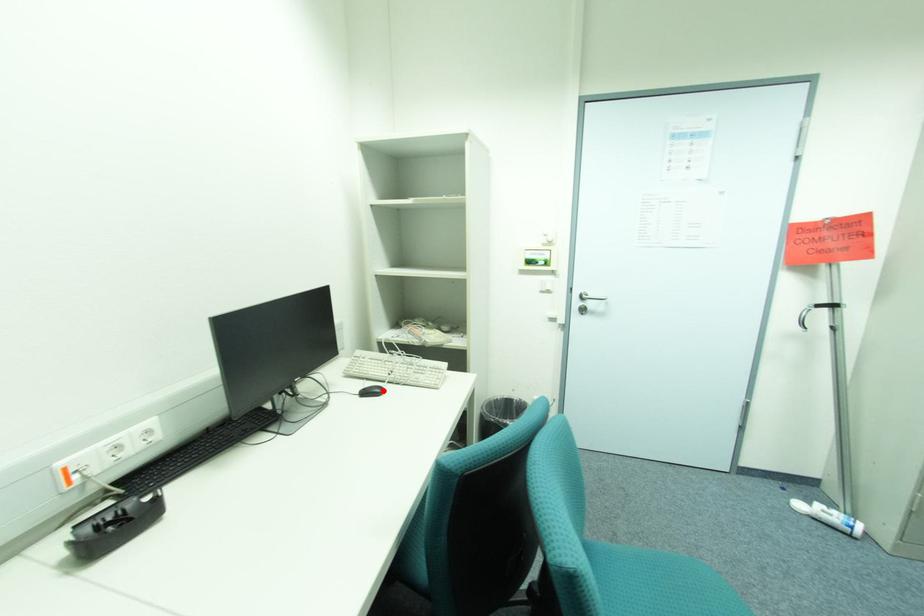
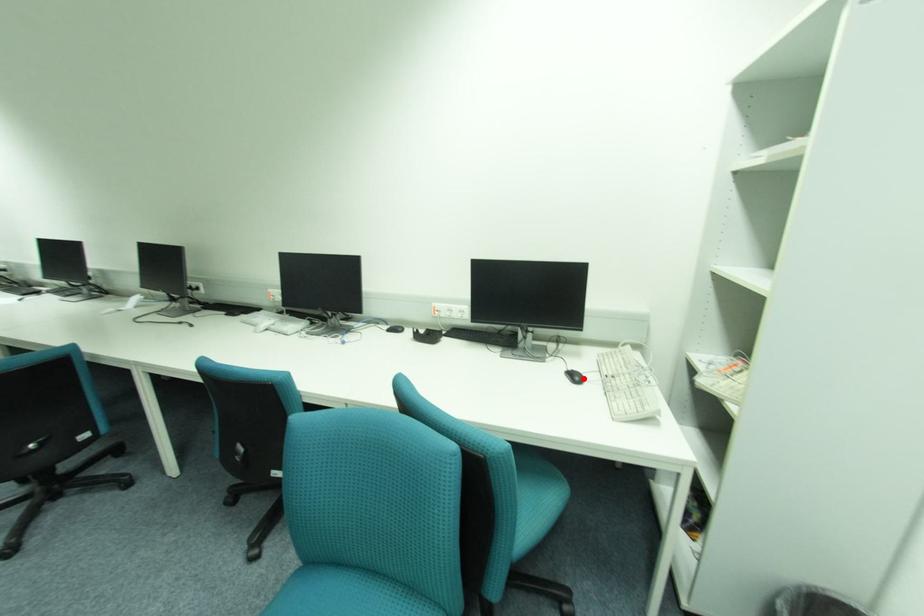
I am providing you with two images of the same scene from different viewpoints. A red point is marked on the first image and another point is marked on the second image. Is the marked point in image1 the same physical position as the marked point in image2?

Yes